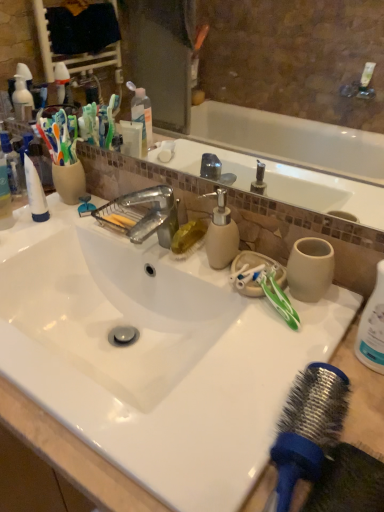
Question: Is point (291, 315) positioned closer to the camera than point (178, 225)?

Choices:
 (A) closer
 (B) farther

Answer: (A)

Question: Choose the correct answer: Is green plastic toothbrush at right inside metallic faucet at center or outside it?

Choices:
 (A) outside
 (B) inside

Answer: (A)

Question: Estimate the real-world distances between objects in this image. Which object is farther from the glossy ceramic mirror at upper center?

Choices:
 (A) blue rubber hair brush at lower right
 (B) green plastic toothbrush at right
 (C) beige matte soap dispenser at center
 (D) white plastic bottle at right
 (E) metallic faucet at center

Answer: (A)

Question: Which is farther from the blue rubber hair brush at lower right?

Choices:
 (A) white plastic bottle at right
 (B) metallic faucet at center
 (C) green plastic toothbrush at right
 (D) beige matte soap dispenser at center
 (E) glossy ceramic mirror at upper center

Answer: (E)